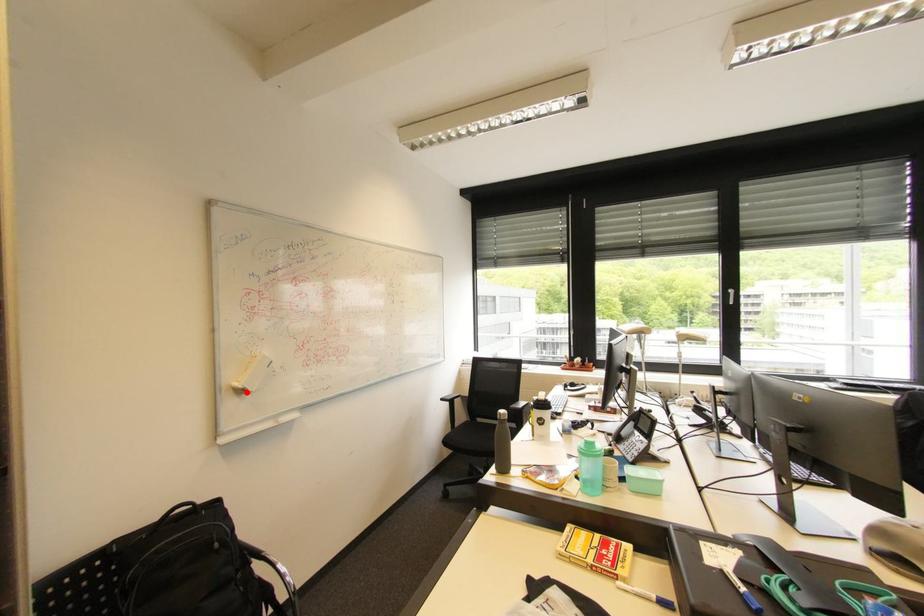
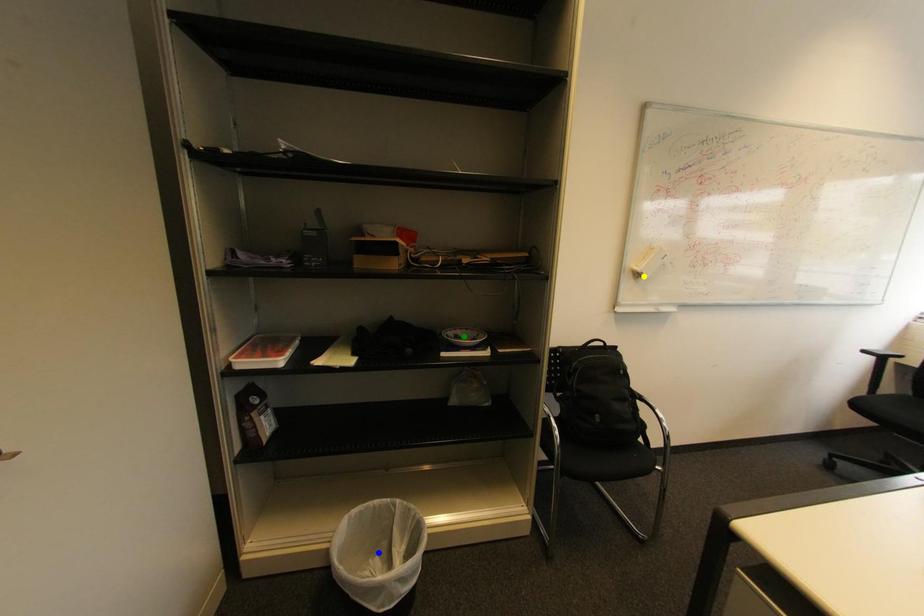
Question: I am providing you with two images of the same scene from different viewpoints. A red point is marked on the first image. You are given multiple points on the second image. Which spot in image 2 lines up with the point in image 1?

Choices:
 (A) yellow point
 (B) blue point
 (C) green point

Answer: (A)